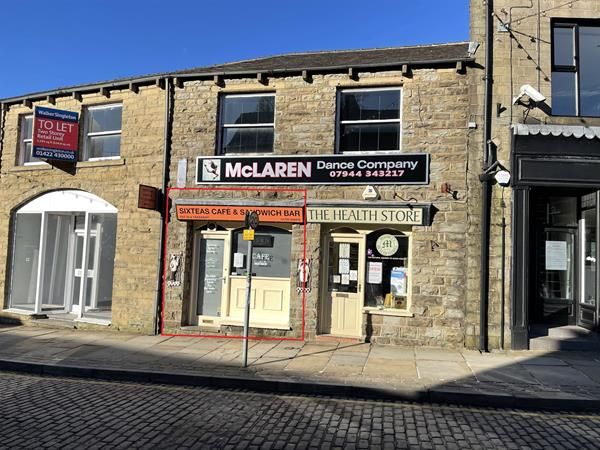
This screenshot has height=450, width=600. I want to click on two pane window, so click(376, 140).